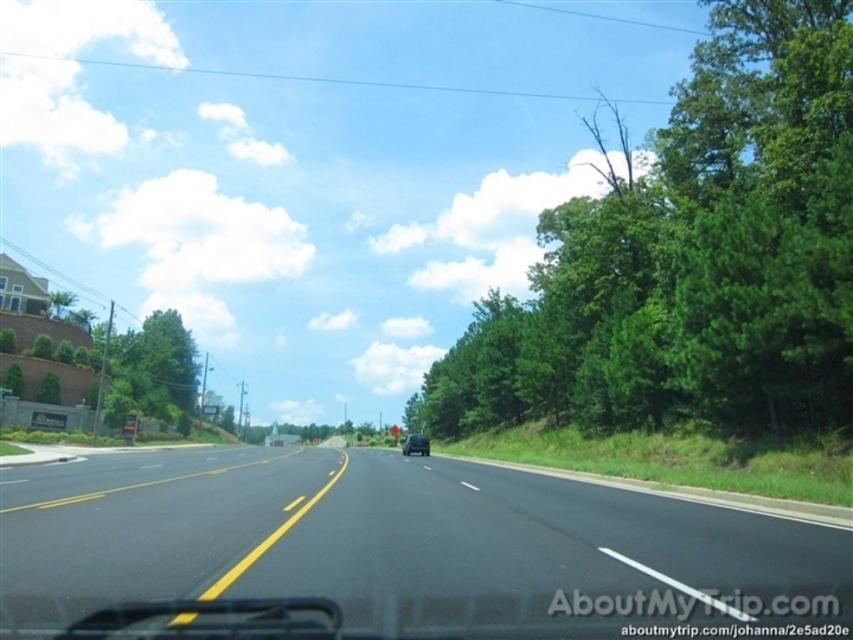
You are sitting in the driver seat of the vehicle and looking out the windshield. There are two points marked on the road ahead. The first point is at coordinate point (x=848, y=76) and the second point is at coordinate point (x=427, y=445). Which point is closer to your current position?

Point (x=848, y=76) is closer to the viewer than point (x=427, y=445), so the first point is closer to your current position.

You are driving a car that is 15 feet long. You are currently on the black asphalt highway at center and want to overtake the black matte car at center. Given the distance between them, can you safely complete the pass without cutting off the other vehicle, assuming standard overtaking rules require a 200 feet safety distance?

The distance between the black asphalt highway at center and the black matte car at center is 590.33 feet. Since this distance exceeds the required 200 feet safety distance, you can safely complete the pass without cutting off the other vehicle.

You are driving a car and want to park on the side of the road. Given the scene, can you safely park between the green leafy tree at right and the black asphalt highway at center?

The green leafy tree at right is to the right of the black asphalt highway at center, so there is no space between them for parking. You should look for another spot.